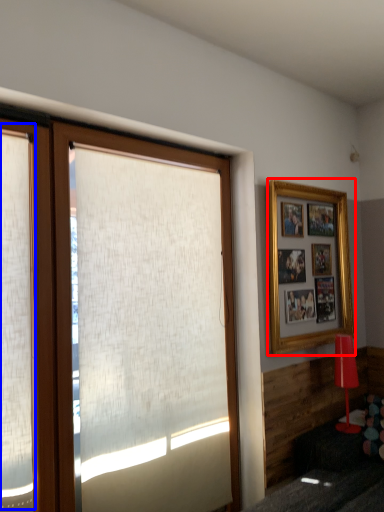
Question: Which object appears closest to the camera in this image, picture frame (highlighted by a red box) or shutter (highlighted by a blue box)?

Choices:
 (A) picture frame
 (B) shutter

Answer: (B)